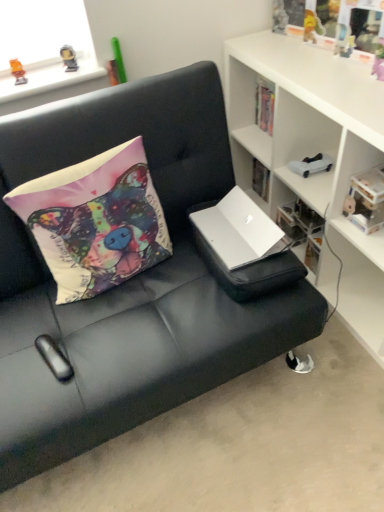
Question: Is translucent plastic toy at upper left, the 1th toy from the left, completely or partially outside of white matte cabinet at upper right?

Choices:
 (A) yes
 (B) no

Answer: (A)

Question: From a real-world perspective, is translucent plastic toy at upper left, which is the 3th toy in back-to-front order, over white matte cabinet at upper right?

Choices:
 (A) no
 (B) yes

Answer: (B)

Question: Can you confirm if translucent plastic toy at upper left, which is counted as the second toy, starting from the bottom, is bigger than white matte cabinet at upper right?

Choices:
 (A) no
 (B) yes

Answer: (A)

Question: Is translucent plastic toy at upper left, the 3th toy positioned from the right, surrounding white matte cabinet at upper right?

Choices:
 (A) yes
 (B) no

Answer: (B)

Question: Does translucent plastic toy at upper left, the 3th toy positioned from the right, touch white matte cabinet at upper right?

Choices:
 (A) no
 (B) yes

Answer: (A)

Question: Is white matte cabinet at upper right at the back of translucent plastic toy at upper left, which is counted as the second toy, starting from the bottom?

Choices:
 (A) no
 (B) yes

Answer: (A)

Question: Considering the relative positions of translucent plastic toy at upper left, which is counted as the 1th toy, starting from the front, and white matte laptop at center in the image provided, is translucent plastic toy at upper left, which is counted as the 1th toy, starting from the front, in front of white matte laptop at center?

Choices:
 (A) no
 (B) yes

Answer: (A)

Question: Is translucent plastic toy at upper left, which is the 2th toy from top to bottom, next to white matte laptop at center and touching it?

Choices:
 (A) yes
 (B) no

Answer: (B)

Question: Can you confirm if translucent plastic toy at upper left, the 1th toy from the left, is positioned to the right of white matte laptop at center?

Choices:
 (A) no
 (B) yes

Answer: (A)

Question: Considering the relative sizes of translucent plastic toy at upper left, which is counted as the 1th toy, starting from the front, and white matte laptop at center in the image provided, is translucent plastic toy at upper left, which is counted as the 1th toy, starting from the front, thinner than white matte laptop at center?

Choices:
 (A) yes
 (B) no

Answer: (A)

Question: From the image's perspective, is translucent plastic toy at upper left, the 3th toy positioned from the right, over white matte laptop at center?

Choices:
 (A) yes
 (B) no

Answer: (A)

Question: Can you confirm if translucent plastic toy at upper left, which is the 2th toy from top to bottom, is wider than white matte laptop at center?

Choices:
 (A) yes
 (B) no

Answer: (B)

Question: Does metallic gold figurine at upper left, the 2th toy viewed from the left, turn towards white plastic book at upper right?

Choices:
 (A) no
 (B) yes

Answer: (A)